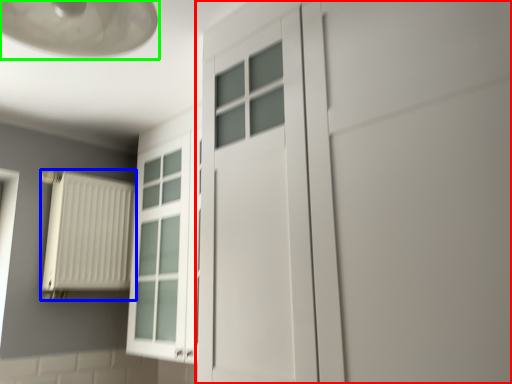
Question: Which object is positioned farthest from door (highlighted by a red box)? Select from radiator (highlighted by a blue box) and lamp (highlighted by a green box).

Choices:
 (A) radiator
 (B) lamp

Answer: (A)